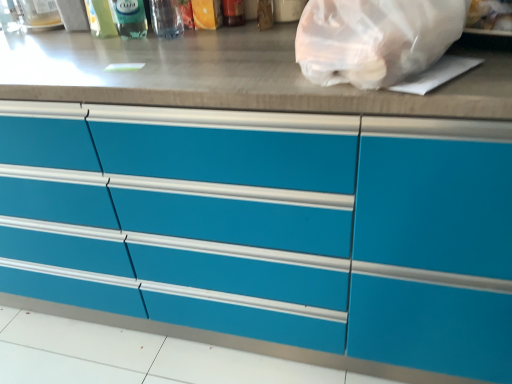
You are a GUI agent. You are given a task and a screenshot of the screen. Output one action in this format:
    pyautogui.click(x=<x>, y=<y>)
    Task: Click on the free space in front of transparent plastic bottle at upper left, which is the second bottle in right-to-left order
    The height and width of the screenshot is (384, 512).
    Given the screenshot: What is the action you would take?
    pyautogui.click(x=130, y=49)